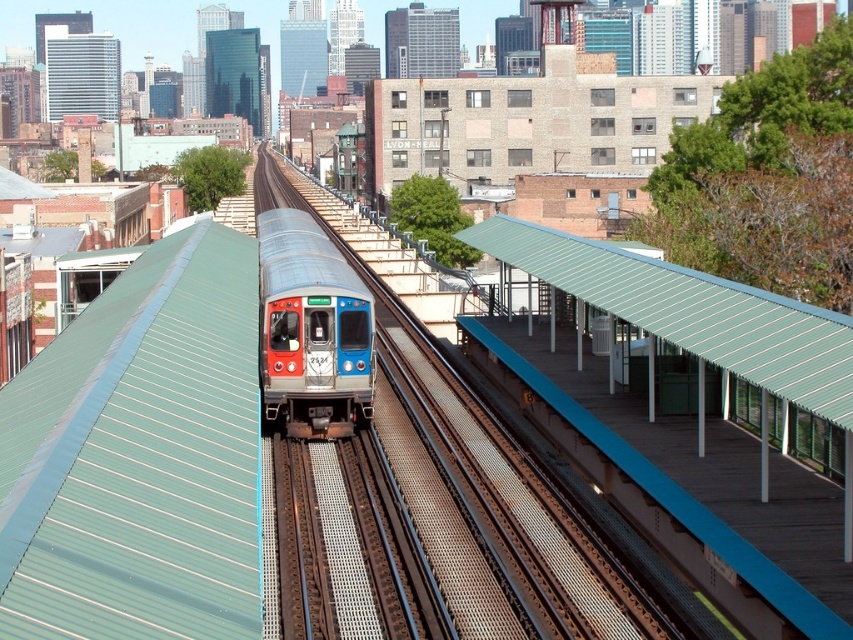
You are a maintenance worker inspecting the train station. You notice the smooth steel train track at center and the metallic blue train at center. Which object is positioned higher from the ground?

The smooth steel train track at center is located above the metallic blue train at center, so the smooth steel train track at center is higher from the ground.

Looking at this image, you are a maintenance worker who needs to inspect the smooth steel train track at center and the green metal platform at right. Which object is elevated higher from the ground?

The smooth steel train track at center is above the green metal platform at right, so the smooth steel train track at center is elevated higher from the ground.

You are a photographer standing at the train station platform. You want to take a photo that includes both the point at coordinates point (x=424, y=432) and the point at coordinates point (x=280, y=214). Which point should you focus on first to ensure both are in sharp focus?

You should focus on point (x=280, y=214) first because it is farther from the camera than point (x=424, y=432). By focusing on the farther point, the closer point will also be within the depth of field, ensuring both are in sharp focus.